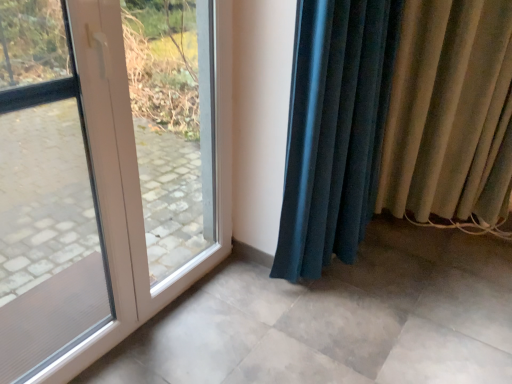
Question: Is white plastic door at left not close to beige fabric curtain at right, arranged as the second curtain when viewed from the left?

Choices:
 (A) yes
 (B) no

Answer: (A)

Question: Is white plastic door at left thinner than beige fabric curtain at right, arranged as the second curtain when viewed from the left?

Choices:
 (A) no
 (B) yes

Answer: (B)

Question: From the image's perspective, is white plastic door at left above beige fabric curtain at right, arranged as the second curtain when viewed from the left?

Choices:
 (A) no
 (B) yes

Answer: (A)

Question: Is white plastic door at left facing away from beige fabric curtain at right, arranged as the second curtain when viewed from the left?

Choices:
 (A) no
 (B) yes

Answer: (A)

Question: Considering the relative sizes of white plastic door at left and beige fabric curtain at right, positioned as the 1th curtain in right-to-left order, in the image provided, is white plastic door at left smaller than beige fabric curtain at right, positioned as the 1th curtain in right-to-left order,?

Choices:
 (A) no
 (B) yes

Answer: (B)

Question: Is the depth of white plastic door at left greater than that of beige fabric curtain at right, positioned as the 1th curtain in right-to-left order?

Choices:
 (A) no
 (B) yes

Answer: (A)

Question: Does velvet teal curtain at lower right, placed as the second curtain when sorted from right to left, turn towards beige fabric curtain at right, arranged as the second curtain when viewed from the left?

Choices:
 (A) yes
 (B) no

Answer: (B)

Question: Considering the relative sizes of velvet teal curtain at lower right, placed as the second curtain when sorted from right to left, and beige fabric curtain at right, positioned as the 1th curtain in right-to-left order, in the image provided, is velvet teal curtain at lower right, placed as the second curtain when sorted from right to left, taller than beige fabric curtain at right, positioned as the 1th curtain in right-to-left order,?

Choices:
 (A) no
 (B) yes

Answer: (B)

Question: Is velvet teal curtain at lower right, placed as the second curtain when sorted from right to left, outside beige fabric curtain at right, positioned as the 1th curtain in right-to-left order?

Choices:
 (A) no
 (B) yes

Answer: (B)

Question: Is there a large distance between velvet teal curtain at lower right, acting as the first curtain starting from the left, and beige fabric curtain at right, arranged as the second curtain when viewed from the left?

Choices:
 (A) yes
 (B) no

Answer: (B)

Question: Is velvet teal curtain at lower right, placed as the second curtain when sorted from right to left, bigger than beige fabric curtain at right, arranged as the second curtain when viewed from the left?

Choices:
 (A) no
 (B) yes

Answer: (B)

Question: Is beige fabric curtain at right, positioned as the 1th curtain in right-to-left order, surrounded by velvet teal curtain at lower right, placed as the second curtain when sorted from right to left?

Choices:
 (A) no
 (B) yes

Answer: (A)

Question: From a real-world perspective, does beige fabric curtain at right, arranged as the second curtain when viewed from the left, stand above velvet teal curtain at lower right, placed as the second curtain when sorted from right to left?

Choices:
 (A) yes
 (B) no

Answer: (A)